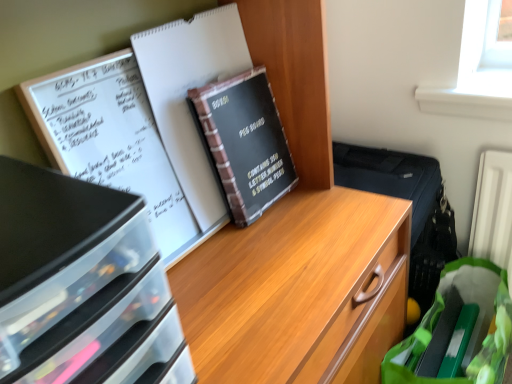
Question: Would you say black matte peg board at center is a long distance from green fabric grocery bag at lower right?

Choices:
 (A) yes
 (B) no

Answer: (B)

Question: Is the position of black matte peg board at center more distant than that of green fabric grocery bag at lower right?

Choices:
 (A) yes
 (B) no

Answer: (B)

Question: From the image's perspective, is black matte peg board at center above green fabric grocery bag at lower right?

Choices:
 (A) yes
 (B) no

Answer: (A)

Question: Is black matte peg board at center at the right side of green fabric grocery bag at lower right?

Choices:
 (A) no
 (B) yes

Answer: (A)

Question: From a real-world perspective, is black matte peg board at center physically below green fabric grocery bag at lower right?

Choices:
 (A) yes
 (B) no

Answer: (B)

Question: Is green fabric grocery bag at lower right bigger or smaller than black matte peg board at center?

Choices:
 (A) small
 (B) big

Answer: (B)

Question: Would you say green fabric grocery bag at lower right is inside or outside black matte peg board at center?

Choices:
 (A) outside
 (B) inside

Answer: (A)

Question: From the image's perspective, is green fabric grocery bag at lower right positioned above or below black matte peg board at center?

Choices:
 (A) below
 (B) above

Answer: (A)

Question: Would you say green fabric grocery bag at lower right is to the left or to the right of black matte peg board at center in the picture?

Choices:
 (A) left
 (B) right

Answer: (B)

Question: Considering their positions, is black paper journal at center located in front of or behind black matte peg board at center?

Choices:
 (A) front
 (B) behind

Answer: (A)

Question: Considering the positions of point (208, 81) and point (216, 84), is point (208, 81) closer or farther from the camera than point (216, 84)?

Choices:
 (A) closer
 (B) farther

Answer: (B)

Question: Based on their sizes in the image, would you say black paper journal at center is bigger or smaller than black matte peg board at center?

Choices:
 (A) small
 (B) big

Answer: (B)

Question: From their relative heights in the image, would you say black paper journal at center is taller or shorter than black matte peg board at center?

Choices:
 (A) short
 (B) tall

Answer: (B)

Question: Based on their sizes in the image, would you say black matte peg board at center is bigger or smaller than black paper journal at center?

Choices:
 (A) big
 (B) small

Answer: (B)

Question: From a real-world perspective, relative to black paper journal at center, is black matte peg board at center vertically above or below?

Choices:
 (A) below
 (B) above

Answer: (A)